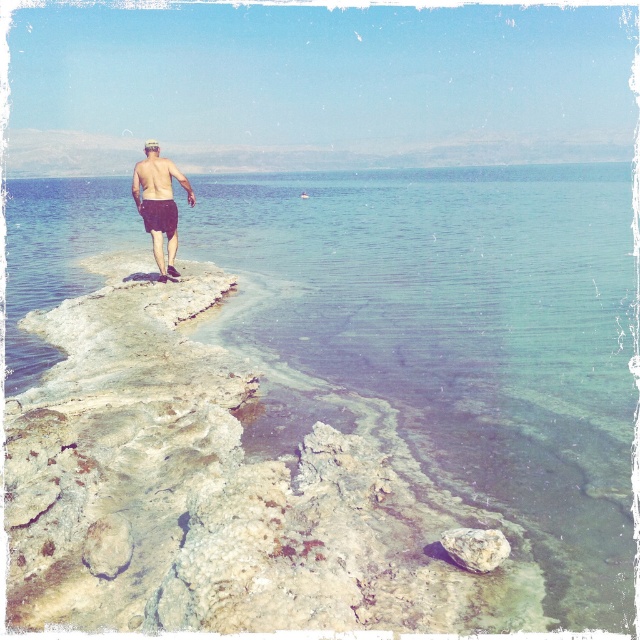
You are a photographer planning to take a photo of the matte black shorts at center and the smooth gray rock at lower right. Based on their positions, which object should you focus on first to ensure both are in sharp focus?

The smooth gray rock at lower right should be focused on first since it is closer to the camera than the matte black shorts at center, which is above it and farther away.

You are standing at the shoreline in the image and want to walk towards the water. There are two points marked on the ground ahead of you at coordinates point (486, 419) and point (470, 554). Which point is closer to you as you face the water?

Point (486, 419) is closer to you because it is further to the camera than point (470, 554), meaning it is physically nearer to your current position.

You are a photographer planning to take a picture of the matte black shorts at center and the smooth gray rock at lower right. Which object should you focus on first if you want to capture both clearly in the same frame?

The matte black shorts at center is larger in size than the smooth gray rock at lower right, so you should focus on the matte black shorts at center first to ensure both are in focus.